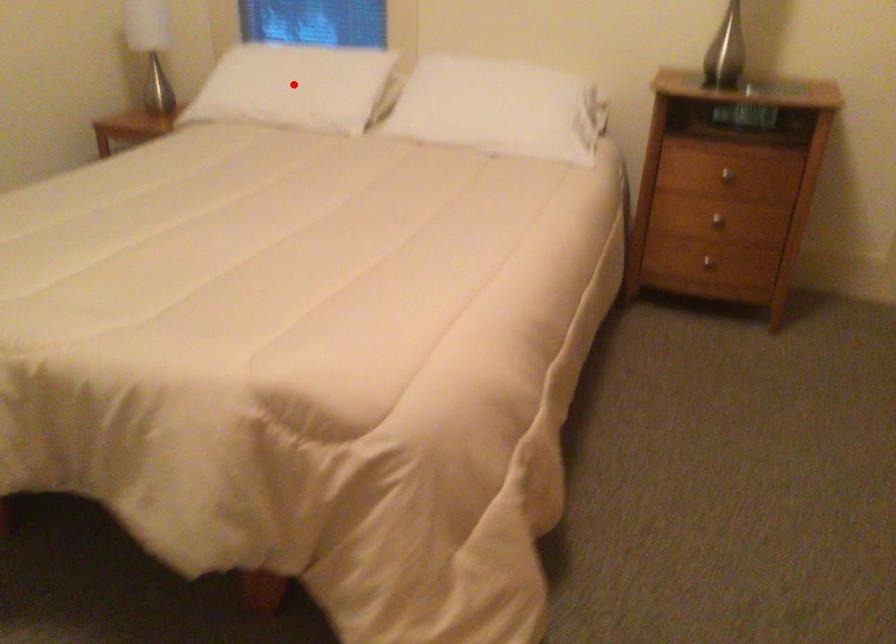
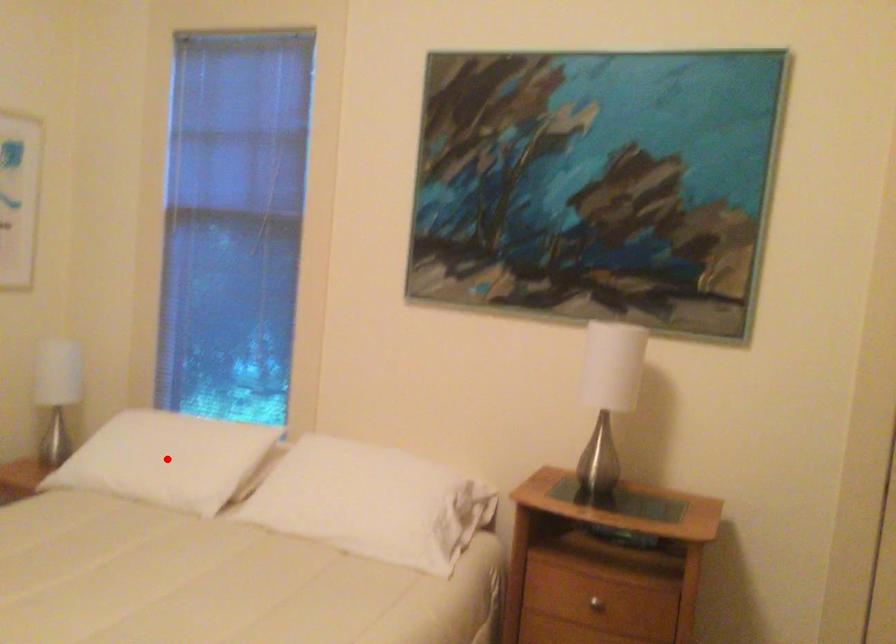
I am providing you with two images of the same scene from different viewpoints. A red point is marked on the first image and another point is marked on the second image. Is the marked point in image1 the same physical position as the marked point in image2?

Yes